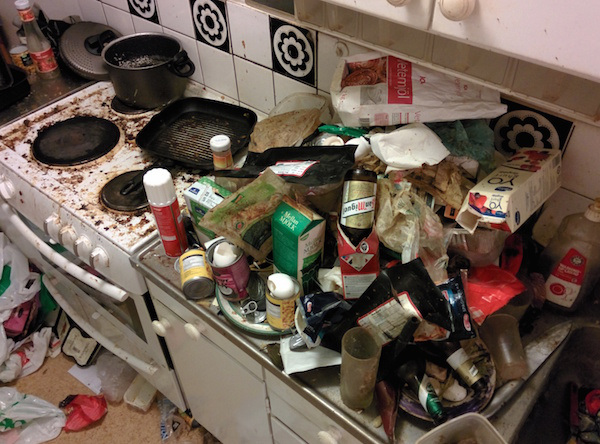
Where is `oven door`? Image resolution: width=600 pixels, height=444 pixels. oven door is located at coordinates (110, 301).